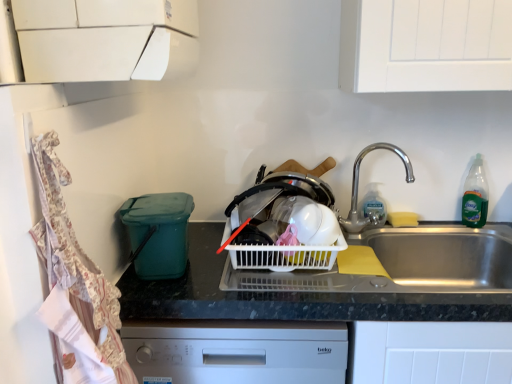
Question: Does silver metallic faucet at upper right have a larger size compared to teal plastic bin at left?

Choices:
 (A) yes
 (B) no

Answer: (B)

Question: Does silver metallic faucet at upper right appear on the right side of teal plastic bin at left?

Choices:
 (A) no
 (B) yes

Answer: (B)

Question: Would you consider silver metallic faucet at upper right to be distant from teal plastic bin at left?

Choices:
 (A) no
 (B) yes

Answer: (A)

Question: Is the depth of silver metallic faucet at upper right less than that of teal plastic bin at left?

Choices:
 (A) yes
 (B) no

Answer: (B)

Question: From the image's perspective, is silver metallic faucet at upper right located above teal plastic bin at left?

Choices:
 (A) no
 (B) yes

Answer: (B)

Question: Is teal plastic bin at left situated inside white plastic basket at center or outside?

Choices:
 (A) outside
 (B) inside

Answer: (A)

Question: Is teal plastic bin at left wider or thinner than white plastic basket at center?

Choices:
 (A) thin
 (B) wide

Answer: (A)

Question: Considering the positions of teal plastic bin at left and white plastic basket at center in the image, is teal plastic bin at left bigger or smaller than white plastic basket at center?

Choices:
 (A) big
 (B) small

Answer: (A)

Question: Considering their positions, is teal plastic bin at left located in front of or behind white plastic basket at center?

Choices:
 (A) behind
 (B) front

Answer: (B)

Question: From the image's perspective, relative to white plastic basket at center, is black plastic container at left above or below?

Choices:
 (A) above
 (B) below

Answer: (B)

Question: Visually, is black plastic container at left positioned to the left or to the right of white plastic basket at center?

Choices:
 (A) left
 (B) right

Answer: (A)

Question: From a real-world perspective, relative to white plastic basket at center, is black plastic container at left vertically above or below?

Choices:
 (A) below
 (B) above

Answer: (A)

Question: Is black plastic container at left inside or outside of white plastic basket at center?

Choices:
 (A) outside
 (B) inside

Answer: (A)

Question: Does point (278, 190) appear closer or farther from the camera than point (87, 292)?

Choices:
 (A) closer
 (B) farther

Answer: (B)

Question: Is white plastic basket at center bigger or smaller than teal plastic bin at left?

Choices:
 (A) big
 (B) small

Answer: (B)